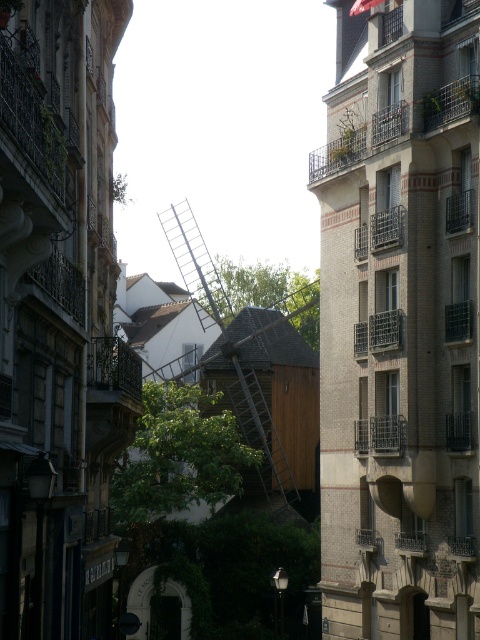
Question: Does white brick building at center appear on the left side of wooden ladder at center?

Choices:
 (A) yes
 (B) no

Answer: (B)

Question: Among these points, which one is nearest to the camera?

Choices:
 (A) (235, 408)
 (B) (464, 339)

Answer: (B)

Question: Is white brick building at center further to the viewer compared to wooden ladder at center?

Choices:
 (A) no
 (B) yes

Answer: (A)

Question: Among these points, which one is farthest from the camera?

Choices:
 (A) (228, 310)
 (B) (444, 401)

Answer: (A)

Question: Is white brick building at center bigger than wooden ladder at center?

Choices:
 (A) yes
 (B) no

Answer: (B)